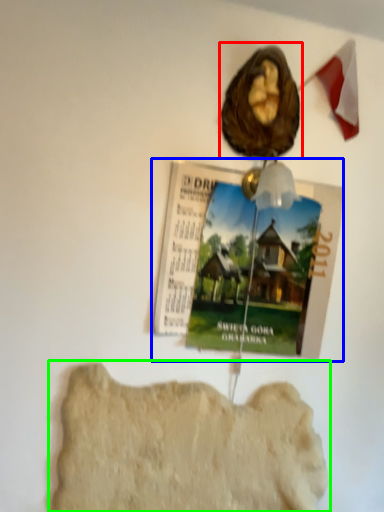
Question: Estimate the real-world distances between objects in this image. Which object is farther from art (highlighted by a red box), magazine (highlighted by a blue box) or rock formation (highlighted by a green box)?

Choices:
 (A) magazine
 (B) rock formation

Answer: (B)